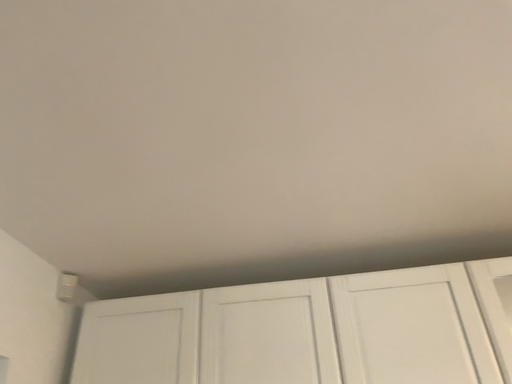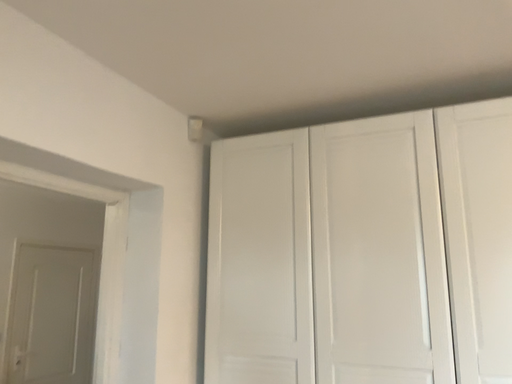
Question: Which way did the camera rotate in the video?

Choices:
 (A) rotated downward
 (B) rotated upward

Answer: (A)